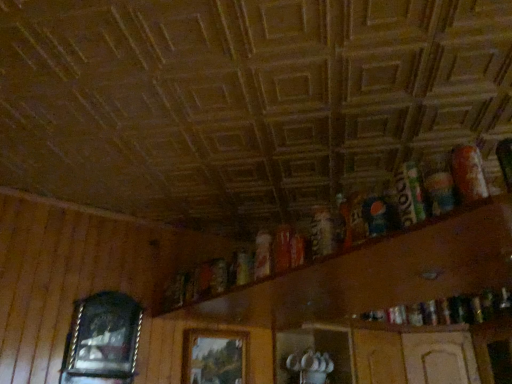
Question: Looking at their shapes, would you say wooden picture frame at left, the 1th picture frame from the left, is wider or thinner than wooden shelf at upper right, the 1th shelf from the right?

Choices:
 (A) thin
 (B) wide

Answer: (A)

Question: Considering their positions, is wooden picture frame at left, the 1th picture frame from the left, located in front of or behind wooden shelf at upper right, the 1th shelf from the right?

Choices:
 (A) front
 (B) behind

Answer: (B)

Question: Estimate the real-world distances between objects in this image. Which object is closer to the wooden picture frame at left, the 1th picture frame from the left?

Choices:
 (A) wooden shelf at upper right, the 2th shelf in the left-to-right sequence
 (B) wooden cabinet at lower center, which ranks as the first shelf in left-to-right order
 (C) wooden picture frame at center, acting as the first picture frame starting from the right

Answer: (C)

Question: Estimate the real-world distances between objects in this image. Which object is closer to the wooden cabinet at lower center, which ranks as the first shelf in left-to-right order?

Choices:
 (A) wooden picture frame at left, the 1th picture frame from the left
 (B) wooden shelf at upper right, the 2th shelf in the left-to-right sequence
 (C) wooden picture frame at center, the second picture frame when ordered from left to right

Answer: (C)